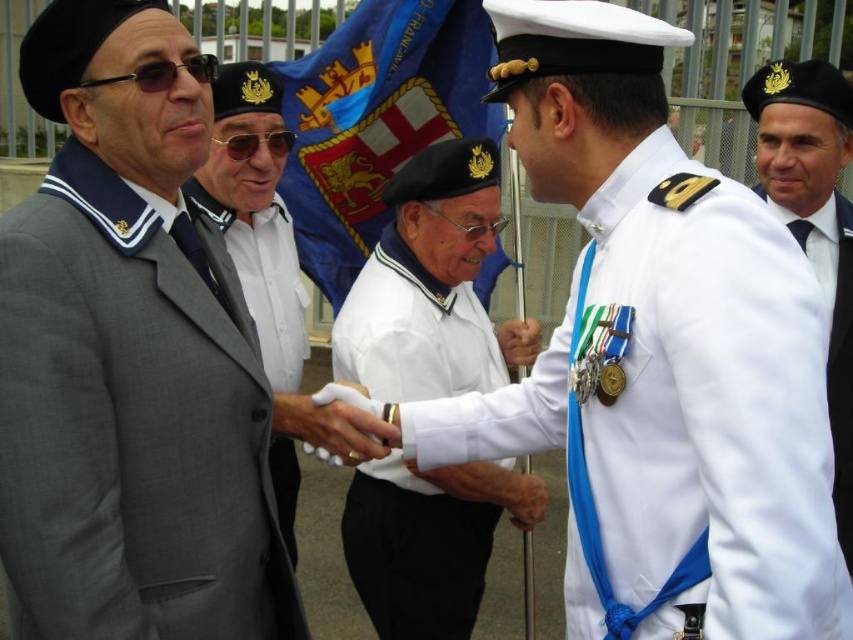
Can you confirm if gray wool suit at left is bigger than blue fabric flag at center?

Incorrect, gray wool suit at left is not larger than blue fabric flag at center.

Who is higher up, gray wool suit at left or blue fabric flag at center?

blue fabric flag at center is higher up.

Measure the distance between point (200, 500) and camera.

Point (200, 500) and camera are 15.43 feet apart from each other.

Locate an element on the screen. This screenshot has width=853, height=640. gray wool suit at left is located at coordinates (131, 424).

Which is in front, point (648, 536) or point (248, 241)?

Positioned in front is point (648, 536).

The height and width of the screenshot is (640, 853). I want to click on white uniform at center, so click(660, 355).

Identify the location of white uniform at center. The height and width of the screenshot is (640, 853). (660, 355).

Which is above, gray wool suit at left or matte gray suit at left?

matte gray suit at left is above.

Between point (181, 353) and point (256, 106), which one is positioned in front?

Positioned in front is point (181, 353).

Locate an element on the screen. This screenshot has height=640, width=853. gray wool suit at left is located at coordinates (131, 424).